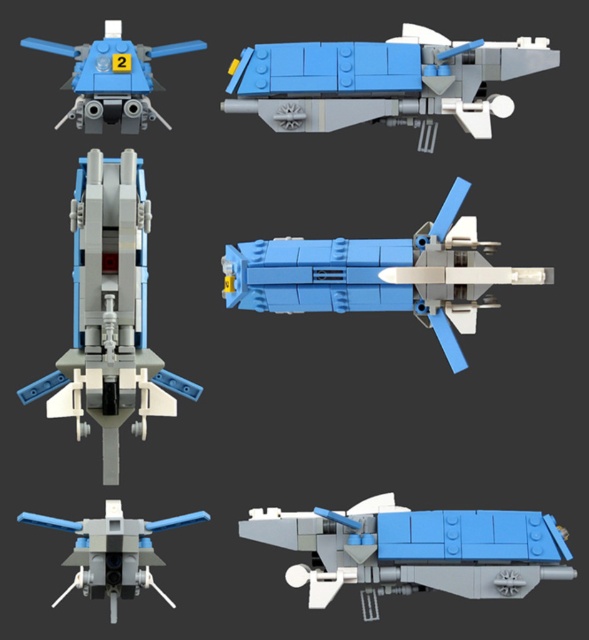
You are standing in a LEGO exhibition hall and see the blue matte spaceship at center displayed on a pedestal. If you want to take a photo of the spaceship without any obstructions, how far back should you stand to ensure the entire spacecraft fits in your camera frame?

The blue matte spaceship at center is 4.18 meters away from the viewer. To capture the entire spacecraft without obstructions, you should stand at least 4.18 meters away to ensure the camera frame can encompass the entire model.